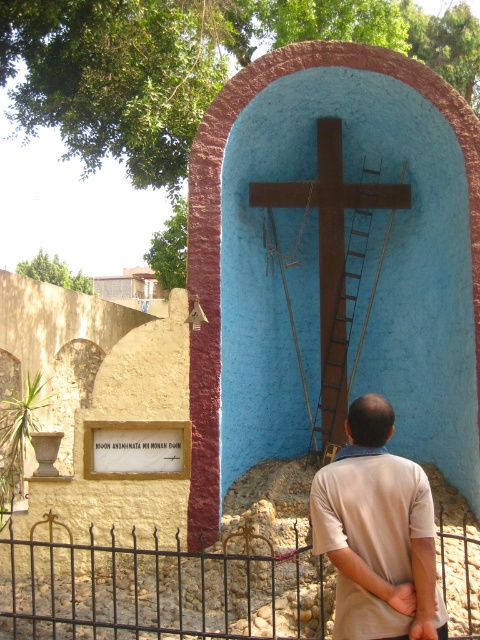
You are standing in front of the religious scene described. You notice the black wrought iron fence at lower center and the beige cotton shirt at center. Which object is positioned lower in the image?

The black wrought iron fence at lower center is positioned lower than the beige cotton shirt at center.